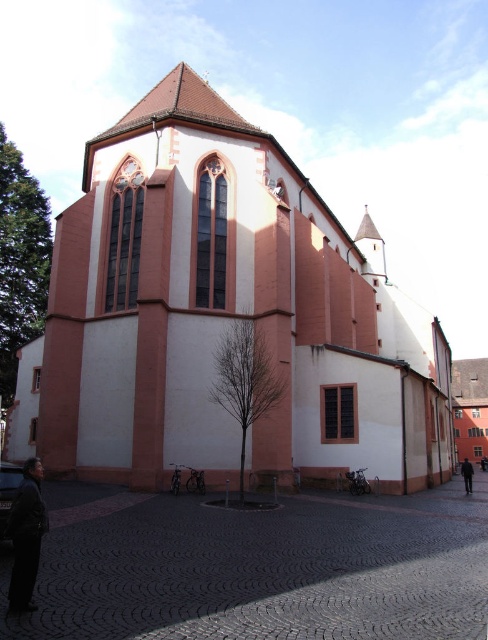
Does pink matte church at center have a greater width compared to black leather jacket at lower left?

Yes.

Which is behind, point (242, 141) or point (29, 525)?

Point (242, 141)

The image size is (488, 640). In order to click on pink matte church at center in this screenshot , I will do `click(223, 316)`.

Between point (15, 605) and point (471, 481), which one is positioned in front?

Positioned in front is point (15, 605).

The height and width of the screenshot is (640, 488). I want to click on black leather jacket at lower left, so click(26, 536).

Find the location of a particular element. This screenshot has width=488, height=640. black leather jacket at lower left is located at coordinates (26, 536).

Is pink matte church at center further to the viewer compared to dark fabric jacket at lower right?

No, it is not.

Where is `pink matte church at center`? pink matte church at center is located at coordinates (223, 316).